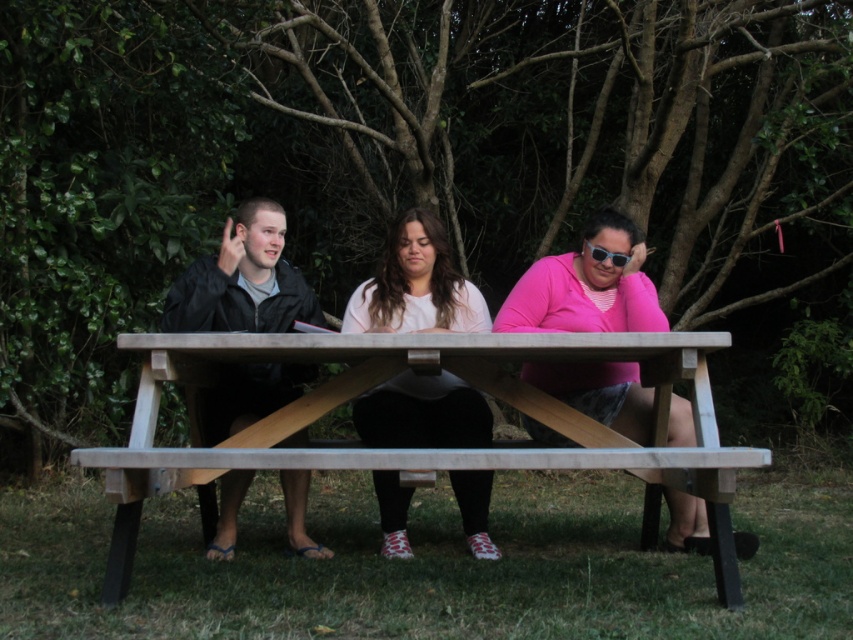
You are standing at the picnic table and want to place a small snack between the two points, point (212,362) and point (384,268). Which point should you place it closer to so it is in front of both points?

You should place the snack closer to point (212,362) because it is in front of point (384,268).

You are planning to buy a new outfit and want to compare the sizes of the pink matte shirt at center and the matte black jacket at left in the image. Which one is narrower?

The pink matte shirt at center is narrower than the matte black jacket at left.

You are standing at the location of the pink matte shirt at center and want to take a photo of the camera. Is the camera within the range of a standard smartphone camera lens? Assume the maximum focus distance for a smartphone is 3 meters.

The camera is 3.63 meters away from the pink matte shirt at center. Since the maximum focus distance is 3 meters, the camera is out of range for a standard smartphone camera lens.